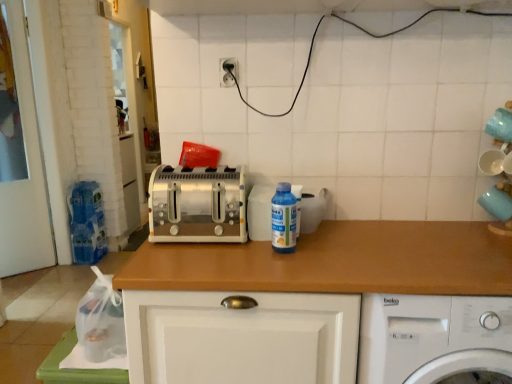
I want to click on vacant region to the right of transparent plastic bottle at center, so click(x=327, y=239).